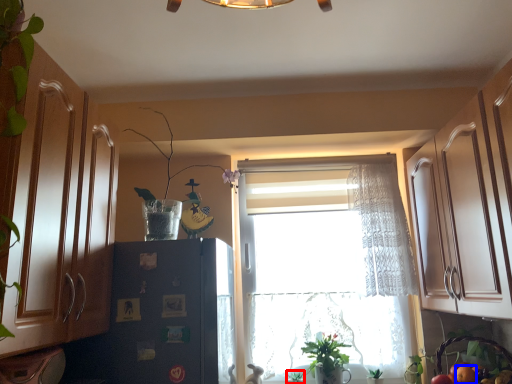
Question: Among these objects, which one is farthest to the camera, plant (highlighted by a red box) or fruit (highlighted by a blue box)?

Choices:
 (A) plant
 (B) fruit

Answer: (A)